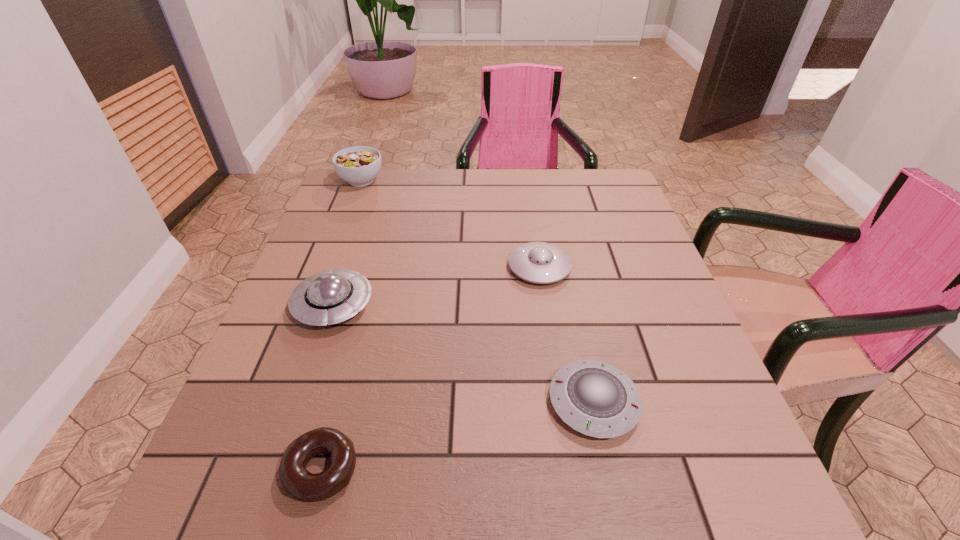
At what (x,y) coordinates should I click in order to perform the action: click on free region that satisfies the following two spatial constraints: 1. on the back side of the doughnut; 2. on the left side of the nearest saucer. Please return your answer as a coordinate pair (x, y). The image size is (960, 540). Looking at the image, I should click on (339, 402).

Image resolution: width=960 pixels, height=540 pixels. In order to click on free space that satisfies the following two spatial constraints: 1. on the front side of the leftmost saucer; 2. on the left side of the nearest saucer in this screenshot , I will do `click(300, 402)`.